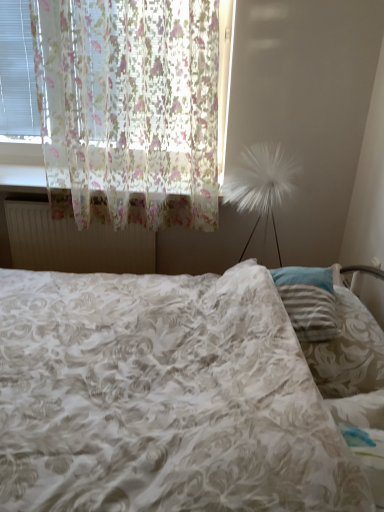
Question: From the image's perspective, is translucent floral fabric at left below white fluffy lamp at right?

Choices:
 (A) yes
 (B) no

Answer: (B)

Question: Is translucent floral fabric at left smaller than white fluffy lamp at right?

Choices:
 (A) yes
 (B) no

Answer: (B)

Question: Is white fluffy lamp at right completely or partially inside translucent floral fabric at left?

Choices:
 (A) no
 (B) yes

Answer: (A)

Question: From a real-world perspective, is translucent floral fabric at left beneath white fluffy lamp at right?

Choices:
 (A) yes
 (B) no

Answer: (B)

Question: Is translucent floral fabric at left oriented towards white fluffy lamp at right?

Choices:
 (A) yes
 (B) no

Answer: (B)

Question: From their relative heights in the image, would you say floral fabric bed at center is taller or shorter than white matte radiator at upper left?

Choices:
 (A) tall
 (B) short

Answer: (A)

Question: Considering the positions of floral fabric bed at center and white matte radiator at upper left in the image, is floral fabric bed at center bigger or smaller than white matte radiator at upper left?

Choices:
 (A) small
 (B) big

Answer: (B)

Question: Does point (271, 361) appear closer or farther from the camera than point (100, 259)?

Choices:
 (A) closer
 (B) farther

Answer: (A)

Question: Is floral fabric bed at center to the left or to the right of white matte radiator at upper left in the image?

Choices:
 (A) left
 (B) right

Answer: (B)

Question: Would you say white fluffy lamp at right is to the left or to the right of white matte radiator at upper left in the picture?

Choices:
 (A) left
 (B) right

Answer: (B)

Question: Considering the positions of white fluffy lamp at right and white matte radiator at upper left in the image, is white fluffy lamp at right taller or shorter than white matte radiator at upper left?

Choices:
 (A) tall
 (B) short

Answer: (A)

Question: Considering the positions of point (244, 201) and point (152, 236), is point (244, 201) closer or farther from the camera than point (152, 236)?

Choices:
 (A) farther
 (B) closer

Answer: (B)

Question: From a real-world perspective, is white fluffy lamp at right positioned above or below white matte radiator at upper left?

Choices:
 (A) below
 (B) above

Answer: (B)

Question: In terms of size, does floral fabric bed at center appear bigger or smaller than white fluffy lamp at right?

Choices:
 (A) small
 (B) big

Answer: (B)

Question: Considering the positions of floral fabric bed at center and white fluffy lamp at right in the image, is floral fabric bed at center wider or thinner than white fluffy lamp at right?

Choices:
 (A) thin
 (B) wide

Answer: (B)